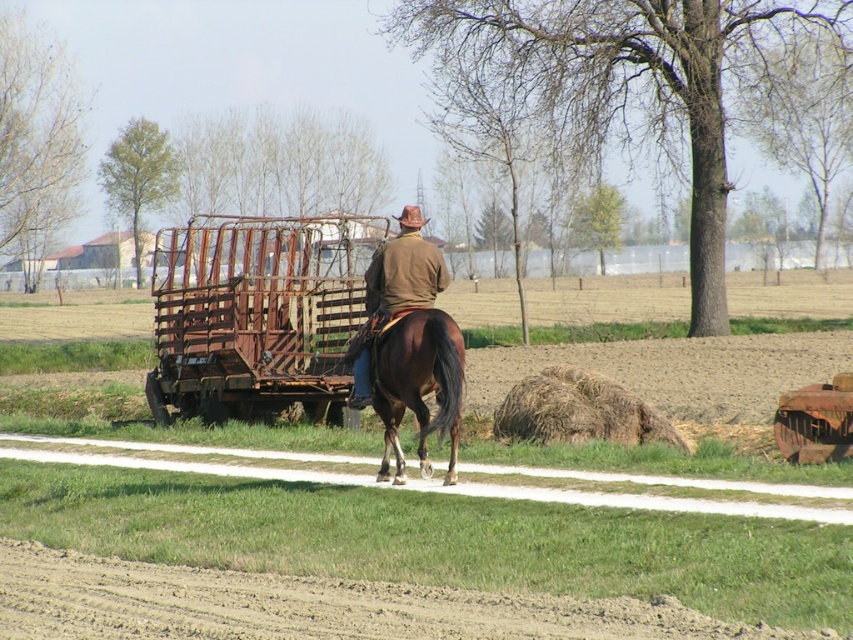
You are standing in the rural scene and want to walk towards the two points marked in the image. Which point, point (392, 348) or point (534, 392), will you reach first?

You will reach point (392, 348) first because it is closer to you than point (534, 392).

You are a photographer taking a picture of the scene. You want to focus on the brown leather jacket at center and the brown glossy horse at center. Which object should you adjust your camera to focus on first if you want to capture both in sharp detail?

The brown glossy horse at center is below brown leather jacket at center, so you should focus on the brown glossy horse at center first to ensure both are in sharp detail.